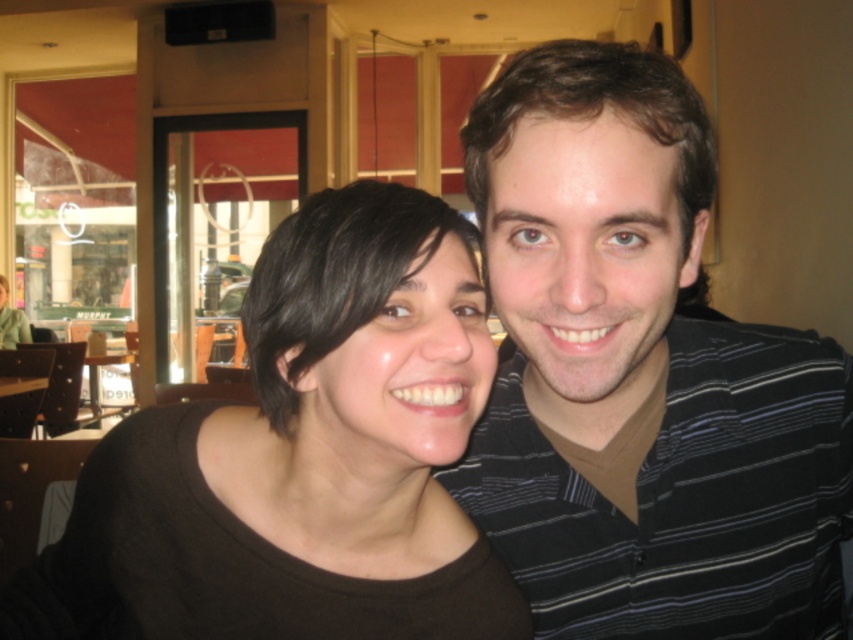
Question: Which point is farther from the camera taking this photo?

Choices:
 (A) (1, 289)
 (B) (496, 637)

Answer: (A)

Question: Can you confirm if brown matte shirt at center is wider than matte black shirt at center?

Choices:
 (A) yes
 (B) no

Answer: (A)

Question: In this image, where is brown matte shirt at center located relative to matte black shirt at center?

Choices:
 (A) below
 (B) above

Answer: (A)

Question: Can you confirm if brown matte shirt at center is wider than matte black shirt at center?

Choices:
 (A) yes
 (B) no

Answer: (A)

Question: Which of the following is the farthest from the observer?

Choices:
 (A) (88, 492)
 (B) (735, 515)

Answer: (A)

Question: Which point appears closest to the camera in this image?

Choices:
 (A) (0, 276)
 (B) (221, 500)

Answer: (B)